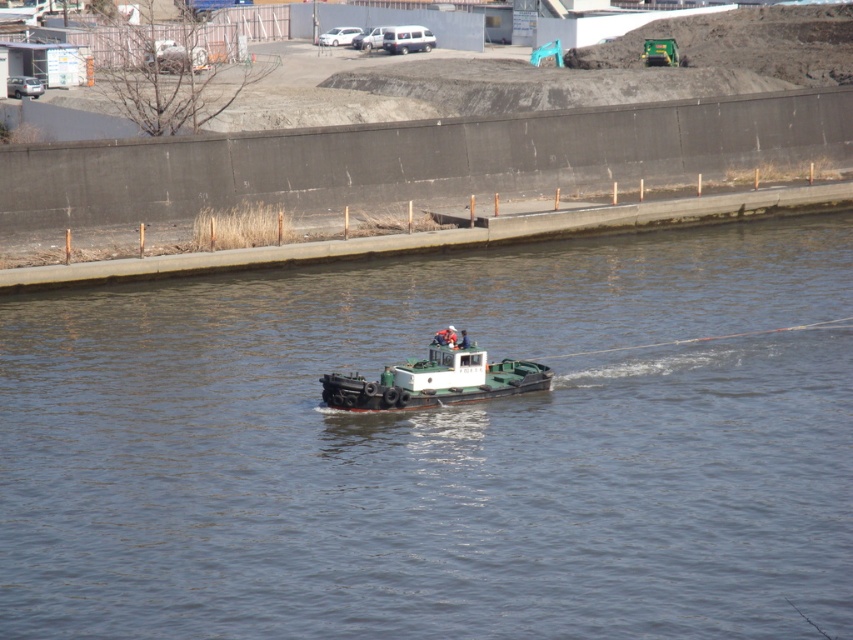
You are a drone operator tasked with capturing aerial footage of the green matte boat at center. The drone is currently at coordinates point 0.600, 0.400. Which direction should you move the drone to reach the boat?

The green matte boat at center is located at point [439,448]. Since the drone is at point [340,384], you should move the drone northeast to reach the boat.

You are on the tugboat and need to navigate to a point marked at coordinates. Which point, point (717, 593) or point (416, 397), is closer to the front of the tugboat?

Point (717, 593) is in front of point (416, 397), so it is closer to the front of the tugboat.

You are standing on the concrete embankment and want to take a photo of the green matte boat at center with your camera. If the camera has a maximum zoom range of 20 meters, will you be able to capture the boat clearly?

The green matte boat at center and camera are 22.94 meters apart, which exceeds the camera maximum zoom range of 20 meters. Therefore, you will not be able to capture the boat clearly.